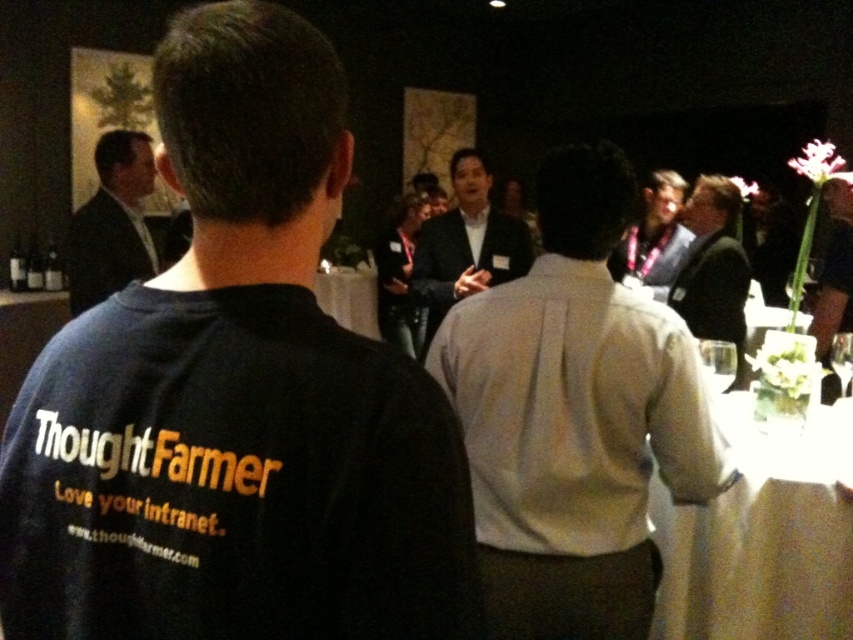
Question: Can you confirm if white shirt at center is bigger than clear glass wine glass at center?

Choices:
 (A) no
 (B) yes

Answer: (B)

Question: Which of the following is the farthest from the observer?

Choices:
 (A) (721, 349)
 (B) (807, 573)
 (C) (645, 209)
 (D) (692, 296)

Answer: (C)

Question: Among these objects, which one is nearest to the camera?

Choices:
 (A) white shirt at center
 (B) dark suit at upper left

Answer: (A)

Question: In this image, where is dark gray suit at center located relative to clear glass wine glass at center?

Choices:
 (A) right
 (B) left

Answer: (B)

Question: Can you confirm if light brown leather jacket at upper right is positioned to the left of transparent glass at upper right?

Choices:
 (A) yes
 (B) no

Answer: (A)

Question: Estimate the real-world distances between objects in this image. Which object is farther from the white shirt at center?

Choices:
 (A) clear glass wine glass at center
 (B) transparent glass at upper right
 (C) dark suit at right
 (D) light brown leather jacket at upper right

Answer: (D)